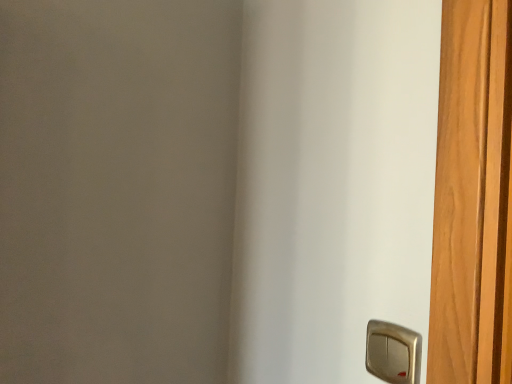
The image size is (512, 384). Describe the element at coordinates (393, 353) in the screenshot. I see `metallic silver door handle at lower right` at that location.

This screenshot has width=512, height=384. Find the location of `metallic silver door handle at lower right`. metallic silver door handle at lower right is located at coordinates (393, 353).

Image resolution: width=512 pixels, height=384 pixels. What are the coordinates of `metallic silver door handle at lower right` in the screenshot? It's located at click(393, 353).